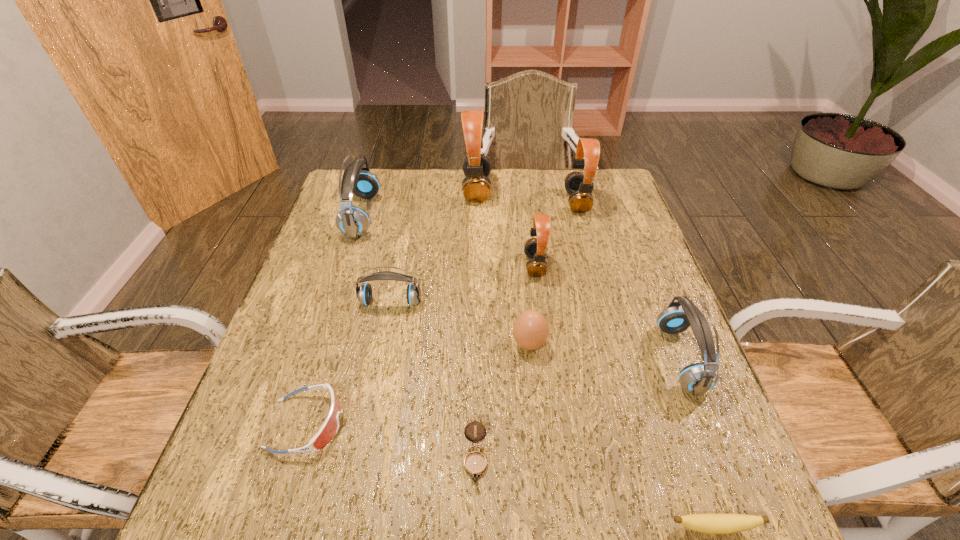
The width and height of the screenshot is (960, 540). In order to click on free region located on the front-facing side of the goggles in this screenshot , I will do `click(530, 423)`.

I want to click on vacant space located on the left of the yellow banana, so click(557, 527).

Find the location of a particular element. The image size is (960, 540). compass that is at the near edge is located at coordinates (475, 463).

You are a GUI agent. You are given a task and a screenshot of the screen. Output one action in this format:
    pyautogui.click(x=<x>, y=<y>)
    Task: Click on the banana situated at the near edge
    The width and height of the screenshot is (960, 540).
    Given the screenshot: What is the action you would take?
    pyautogui.click(x=705, y=523)

You are a GUI agent. You are given a task and a screenshot of the screen. Output one action in this format:
    pyautogui.click(x=<x>, y=<y>)
    Task: Click on the headset that is at the left edge
    This screenshot has height=540, width=960.
    Given the screenshot: What is the action you would take?
    pyautogui.click(x=352, y=221)

Locate an element on the screen. The height and width of the screenshot is (540, 960). goggles present at the left edge is located at coordinates (329, 429).

This screenshot has height=540, width=960. Identify the location of banana located at the right edge. (705, 523).

Identify the location of object at the far left corner. (352, 221).

Locate an element on the screen. The width and height of the screenshot is (960, 540). object situated at the far right corner is located at coordinates (579, 186).

Identify the location of object situated at the near right corner. The height and width of the screenshot is (540, 960). (705, 523).